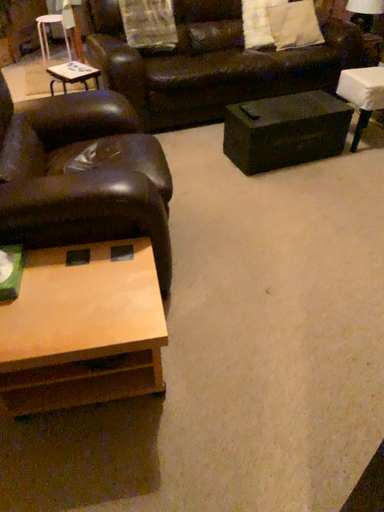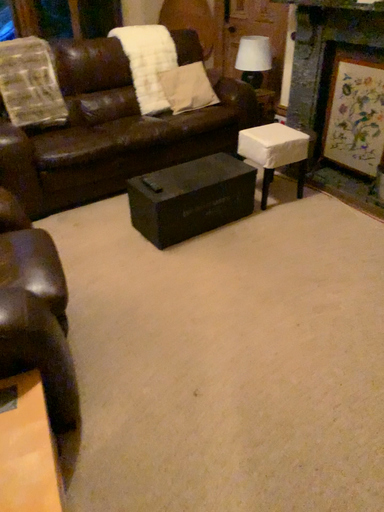
Question: Which way did the camera rotate in the video?

Choices:
 (A) rotated downward
 (B) rotated upward

Answer: (B)